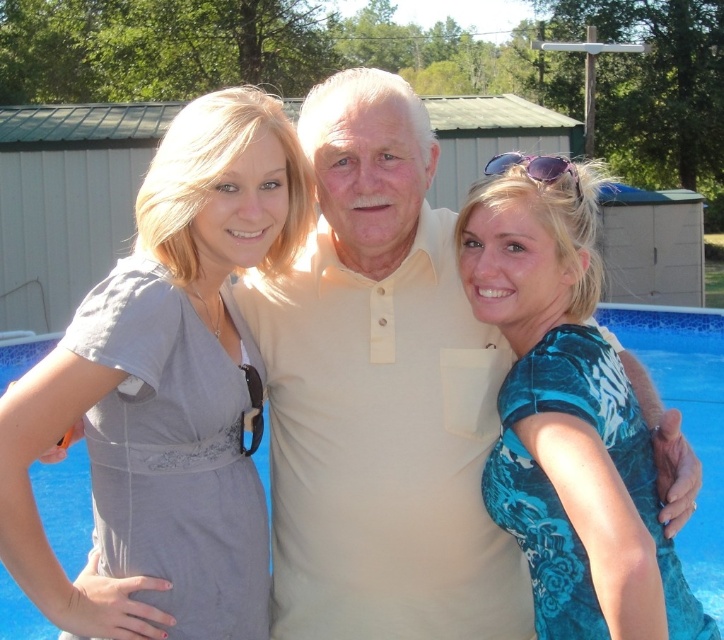
Question: Does gray fabric dress at left appear on the right side of blue floral dress at center?

Choices:
 (A) no
 (B) yes

Answer: (A)

Question: Is gray fabric dress at left wider than blue floral dress at center?

Choices:
 (A) no
 (B) yes

Answer: (B)

Question: Among these objects, which one is nearest to the camera?

Choices:
 (A) gray fabric dress at left
 (B) blue floral dress at center

Answer: (B)

Question: Observing the image, what is the correct spatial positioning of gray fabric dress at left in reference to blue floral dress at center?

Choices:
 (A) left
 (B) right

Answer: (A)